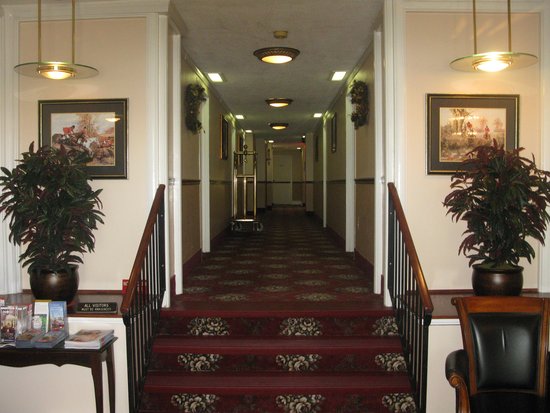
I want to click on ceiling lights, so (279, 58), (51, 74), (484, 68), (342, 75), (278, 108).